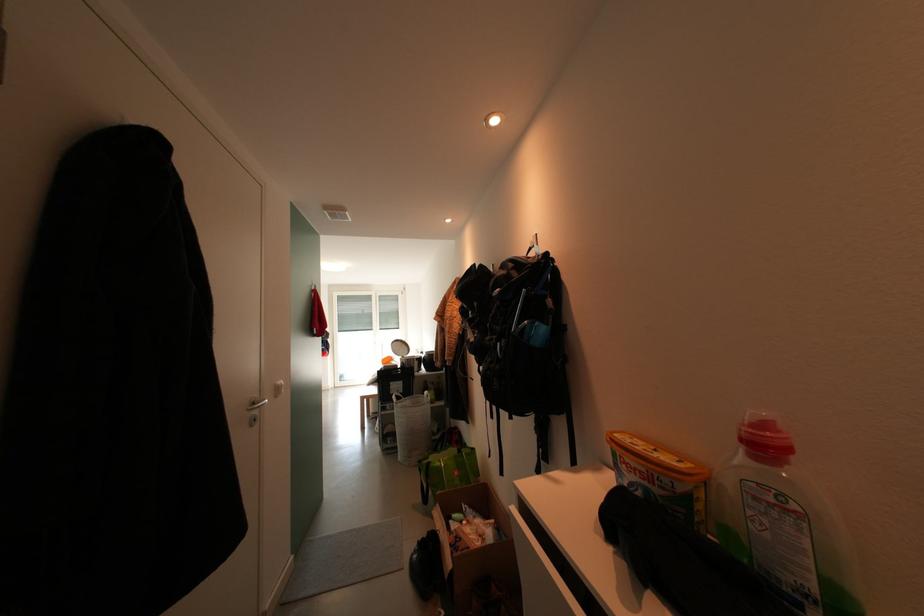
I want to click on white laundry basket, so click(x=411, y=428).